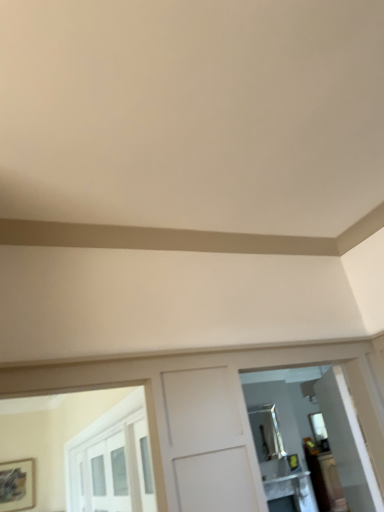
Question: Considering the relative sizes of white glossy table at lower right and matte silver mirror at right, the 2th mirror in the bottom-to-top sequence, in the image provided, is white glossy table at lower right wider than matte silver mirror at right, the 2th mirror in the bottom-to-top sequence,?

Choices:
 (A) yes
 (B) no

Answer: (A)

Question: From a real-world perspective, is white glossy table at lower right on matte silver mirror at right, placed as the second mirror when sorted from back to front?

Choices:
 (A) no
 (B) yes

Answer: (A)

Question: Is white glossy table at lower right directly adjacent to matte silver mirror at right, placed as the second mirror when sorted from back to front?

Choices:
 (A) yes
 (B) no

Answer: (B)

Question: Can you confirm if white glossy table at lower right is thinner than matte silver mirror at right, placed as the 1th mirror when sorted from top to bottom?

Choices:
 (A) yes
 (B) no

Answer: (B)

Question: Is white glossy table at lower right far away from matte silver mirror at right, placed as the second mirror when sorted from back to front?

Choices:
 (A) no
 (B) yes

Answer: (A)

Question: Is white glossy table at lower right shorter than matte silver mirror at right, the 2th mirror in the bottom-to-top sequence?

Choices:
 (A) yes
 (B) no

Answer: (A)

Question: From the image's perspective, is silver metallic mirror at upper center, the second mirror positioned from the top, on top of white glossy table at lower right?

Choices:
 (A) yes
 (B) no

Answer: (A)

Question: Would you say white glossy table at lower right is part of silver metallic mirror at upper center, the second mirror positioned from the top,'s contents?

Choices:
 (A) no
 (B) yes

Answer: (A)

Question: Is silver metallic mirror at upper center, which is the 1th mirror from bottom to top, behind white glossy table at lower right?

Choices:
 (A) no
 (B) yes

Answer: (B)

Question: Is silver metallic mirror at upper center, which is the 1th mirror from bottom to top, positioned beyond the bounds of white glossy table at lower right?

Choices:
 (A) no
 (B) yes

Answer: (B)

Question: Does silver metallic mirror at upper center, which is the 1th mirror from bottom to top, lie in front of white glossy table at lower right?

Choices:
 (A) yes
 (B) no

Answer: (B)

Question: From a real-world perspective, does silver metallic mirror at upper center, the first mirror in the back-to-front sequence, stand above white glossy table at lower right?

Choices:
 (A) no
 (B) yes

Answer: (B)

Question: From a real-world perspective, is matte silver mirror at right, placed as the 1th mirror when sorted from top to bottom, physically below white glossy table at lower right?

Choices:
 (A) yes
 (B) no

Answer: (B)